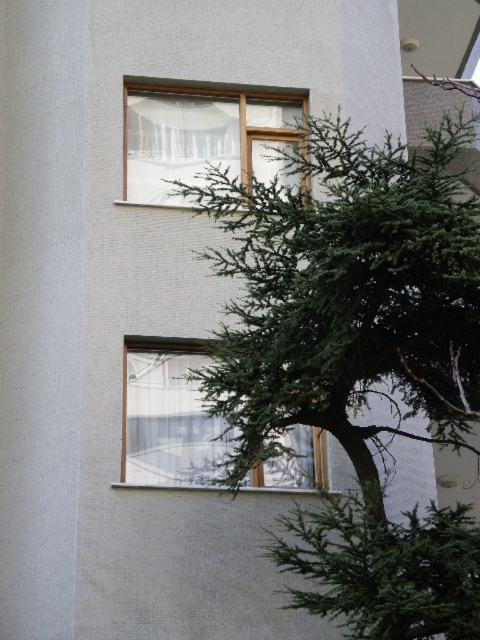
Question: Among these objects, which one is farthest from the camera?

Choices:
 (A) green leafy tree at center
 (B) clear glass window at center
 (C) green needle-like tree at lower right
 (D) transparent glass window at upper center

Answer: (D)

Question: Can you confirm if green leafy tree at center is bigger than clear glass window at center?

Choices:
 (A) yes
 (B) no

Answer: (A)

Question: Is green leafy tree at center to the left of green needle-like tree at lower right from the viewer's perspective?

Choices:
 (A) yes
 (B) no

Answer: (B)

Question: Which of these objects is positioned closest to the green leafy tree at center?

Choices:
 (A) green needle-like tree at lower right
 (B) transparent glass window at upper center

Answer: (A)

Question: Is the position of clear glass window at center less distant than that of transparent glass window at upper center?

Choices:
 (A) yes
 (B) no

Answer: (A)

Question: Which point is farther from the camera taking this photo?

Choices:
 (A) (266, 458)
 (B) (432, 528)

Answer: (B)